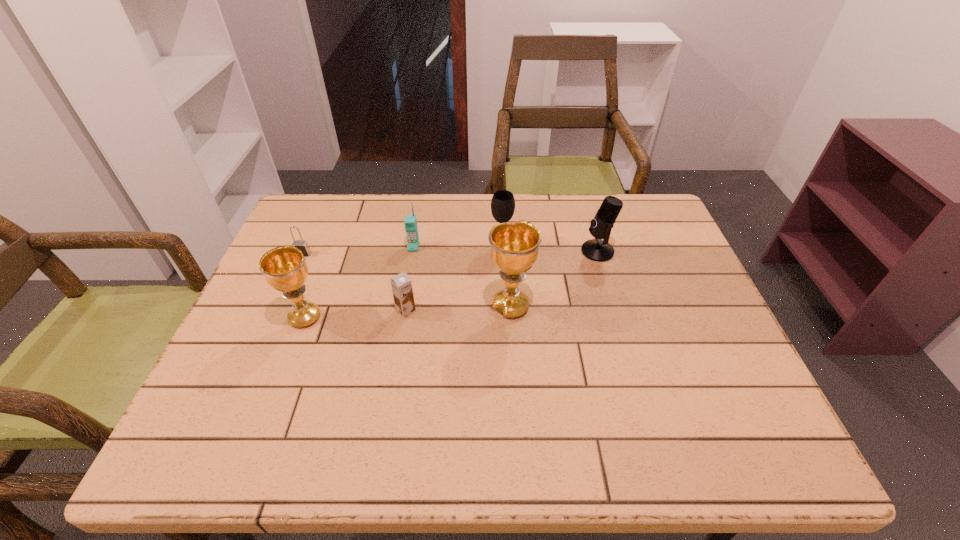
The image size is (960, 540). Identify the location of free space located 0.170m on the back of the shorter chalice. (327, 258).

What are the coordinates of `vacant space situated on the left of the tallest object` in the screenshot? It's located at (410, 307).

Where is `vacant space located 0.270m on the stand of the rightmost object`? vacant space located 0.270m on the stand of the rightmost object is located at coordinates (485, 251).

I want to click on vacant area situated 0.380m on the stand of the rightmost object, so click(x=446, y=251).

Where is `free space located 0.300m on the stand of the rightmost object`? free space located 0.300m on the stand of the rightmost object is located at coordinates (474, 251).

Where is `vacant space located on the keypad of the cellular telephone`? The height and width of the screenshot is (540, 960). vacant space located on the keypad of the cellular telephone is located at coordinates (395, 362).

Locate an element on the screen. The image size is (960, 540). free space located on the front of the wineglass is located at coordinates (504, 295).

Locate an element on the screen. vacant space located on the back of the chocolate milk is located at coordinates (411, 278).

The width and height of the screenshot is (960, 540). I want to click on vacant space located 0.140m on the shackle of the leftmost object, so click(x=285, y=293).

The image size is (960, 540). In order to click on microphone located at the far edge in this screenshot , I will do [599, 250].